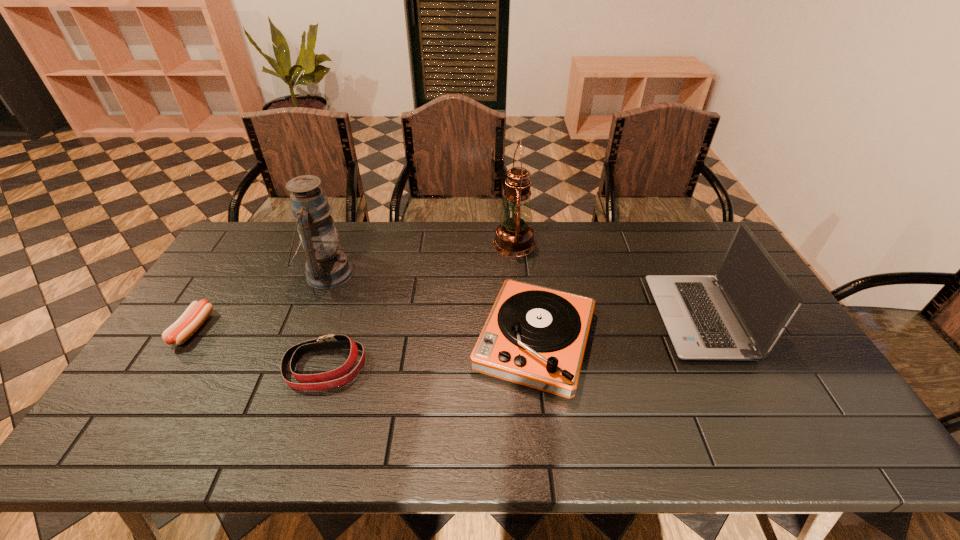
In the image, there is a desktop. At what (x,y) coordinates should I click in order to perform the action: click on vacant region at the left edge. Please return your answer as a coordinate pair (x, y). The height and width of the screenshot is (540, 960). Looking at the image, I should click on (205, 349).

In the image, there is a desktop. Where is `vacant space at the far left corner`? The image size is (960, 540). vacant space at the far left corner is located at coordinates (249, 251).

The image size is (960, 540). Find the location of `free space at the far right corner of the desktop`. free space at the far right corner of the desktop is located at coordinates (707, 226).

Find the location of a particular element. This screenshot has height=540, width=960. unoccupied position between the right oil lamp and the shortest object is located at coordinates (353, 286).

At what (x,y) coordinates should I click in order to perform the action: click on free spot between the left oil lamp and the record player. Please return your answer as a coordinate pair (x, y). This screenshot has height=540, width=960. Looking at the image, I should click on (431, 307).

Locate an element on the screen. The height and width of the screenshot is (540, 960). vacant region between the left oil lamp and the leftmost object is located at coordinates (260, 301).

Where is `vacant area that lies between the leftmost object and the rightmost object`? This screenshot has height=540, width=960. vacant area that lies between the leftmost object and the rightmost object is located at coordinates (445, 323).

Image resolution: width=960 pixels, height=540 pixels. What are the coordinates of `free point between the rightmost object and the fourth tallest object` in the screenshot? It's located at (616, 329).

You are a GUI agent. You are given a task and a screenshot of the screen. Output one action in this format:
    pyautogui.click(x=<x>, y=<y>)
    Task: Click on the free area in between the dog collar and the right oil lamp
    The width and height of the screenshot is (960, 540).
    Given the screenshot: What is the action you would take?
    pyautogui.click(x=420, y=306)

The width and height of the screenshot is (960, 540). What are the coordinates of `empty location between the fourth tallest object and the left oil lamp` in the screenshot? It's located at (431, 307).